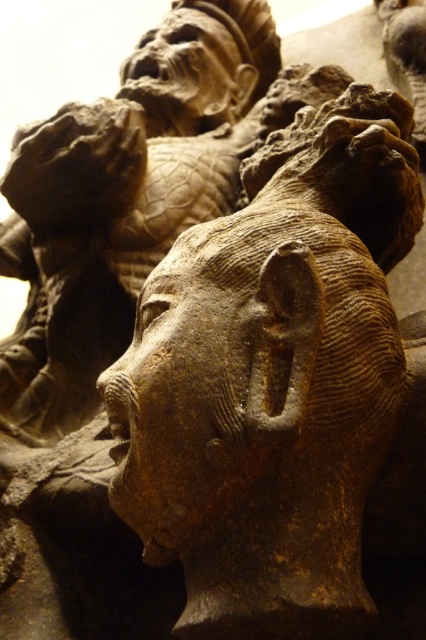
Question: Can you confirm if brown stone face at center is positioned below matte stone face at upper center?

Choices:
 (A) no
 (B) yes

Answer: (B)

Question: Which point is closer to the camera?

Choices:
 (A) (238, 64)
 (B) (192, 504)

Answer: (B)

Question: Which object appears farthest from the camera in this image?

Choices:
 (A) matte stone face at upper center
 (B) brown stone face at center

Answer: (A)

Question: Does brown stone face at center have a smaller size compared to matte stone face at upper center?

Choices:
 (A) no
 (B) yes

Answer: (B)

Question: Does brown stone face at center have a smaller size compared to matte stone face at upper center?

Choices:
 (A) yes
 (B) no

Answer: (A)